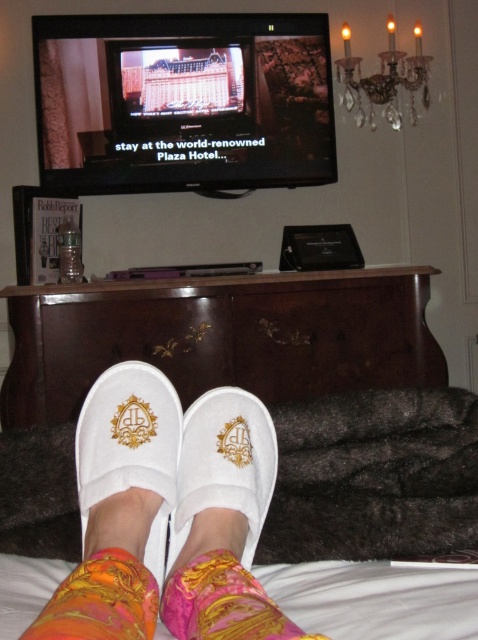
Question: Can you confirm if white fabric slipper at lower center is positioned to the right of multicolored fabric sock at lower center?

Choices:
 (A) yes
 (B) no

Answer: (B)

Question: Which point appears farthest from the camera in this image?

Choices:
 (A) (98, 408)
 (B) (241, 637)

Answer: (A)

Question: Does pink satin sock at lower center have a larger size compared to multicolored fabric sock at lower center?

Choices:
 (A) no
 (B) yes

Answer: (B)

Question: Which of the following is the farthest from the observer?

Choices:
 (A) (220, 496)
 (B) (113, 305)
 (C) (178, 627)

Answer: (B)

Question: Does white wood dresser at center appear under multicolored fabric sock at lower center?

Choices:
 (A) no
 (B) yes

Answer: (A)

Question: Based on their relative distances, which object is farther from the pink satin sock at lower center?

Choices:
 (A) multicolored fabric sock at lower center
 (B) white fabric slipper at center
 (C) white fabric slipper at lower center
 (D) white wood dresser at center

Answer: (D)